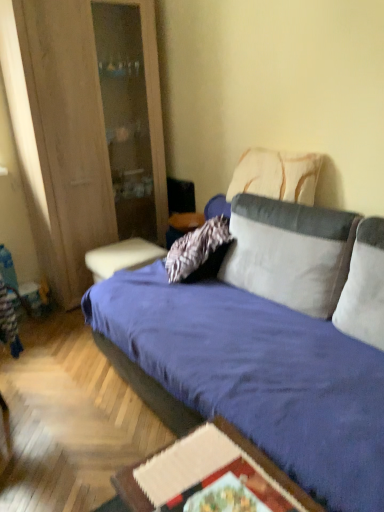
You are a GUI agent. You are given a task and a screenshot of the screen. Output one action in this format:
    pyautogui.click(x=<x>, y=<y>)
    Task: Click on the free space above wooden textured table at lower center, placed as the 2th table when sorted from top to bottom (from a real-world perspective)
    
    Given the screenshot: What is the action you would take?
    pyautogui.click(x=208, y=476)